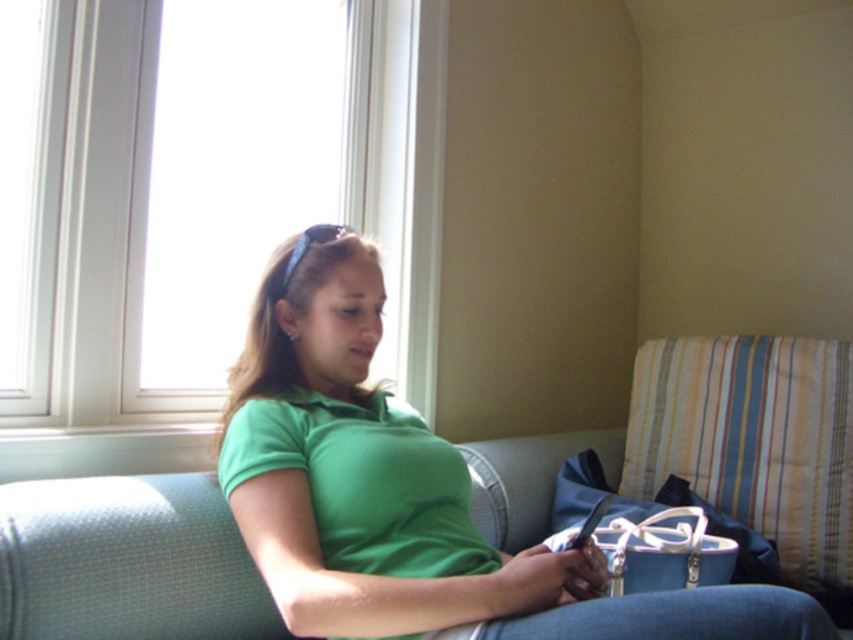
Looking at this image, you are a delivery person trying to place a package on the couch. The package is 26 inches long. You see the white plastic window at upper left and the green matte shirt at center. Can you fit the package between them?

The white plastic window at upper left and green matte shirt at center are 26.76 inches apart from each other, so yes, the package can fit between them as it is slightly shorter than the available space.

You are designing a room layout and want to ensure that the white plastic window at upper left and the striped fabric pillow at right are visible from the entrance. Given their positions and sizes, which object will appear taller when viewed from the entrance?

The white plastic window at upper left appears taller than the striped fabric pillow at right because it has a greater height according to the description.

You are standing in the room and want to know where the white plastic window at upper left is positioned relative to the couch. Can you describe its location using coordinates?

The white plastic window at upper left is located at coordinates point (196,192).